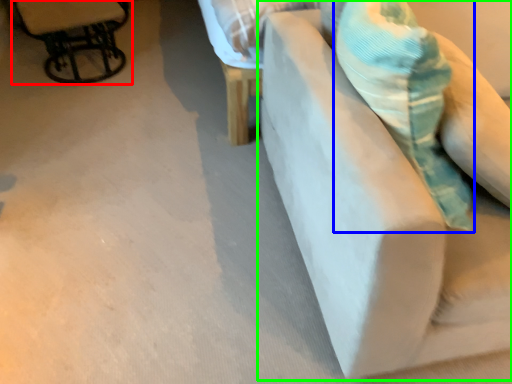
Question: Considering the real-world distances, which object is closest to chair (highlighted by a red box)? throw pillow (highlighted by a blue box) or furniture (highlighted by a green box).

Choices:
 (A) throw pillow
 (B) furniture

Answer: (B)